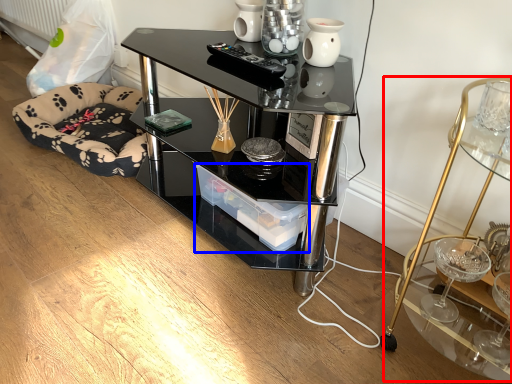
Question: Which of the following is the farthest to the observer, cocktail table (highlighted by a red box) or glass box (highlighted by a blue box)?

Choices:
 (A) cocktail table
 (B) glass box

Answer: (B)